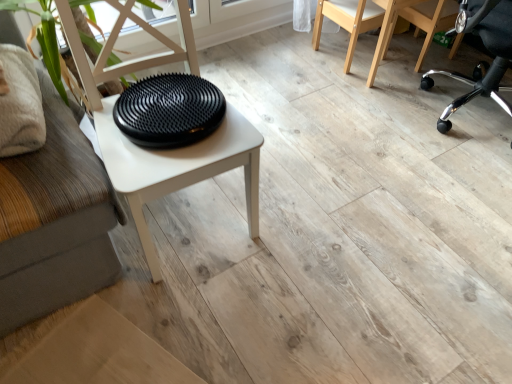
The image size is (512, 384). What do you see at coordinates (169, 110) in the screenshot?
I see `black rubberized disc at center` at bounding box center [169, 110].

You are a GUI agent. You are given a task and a screenshot of the screen. Output one action in this format:
    pyautogui.click(x=<x>, y=<y>)
    Task: Click on the black plastic chair at upper right, the 2th chair from the left
    The image size is (512, 384).
    Given the screenshot: What is the action you would take?
    pyautogui.click(x=412, y=23)

Image resolution: width=512 pixels, height=384 pixels. Identify the location of black plastic office chair at right, the first chair viewed from the right. (481, 61).

Locate an element on the screen. black rubberized disc at center is located at coordinates (169, 110).

Is black rubberized disc at center closer to camera compared to black plastic office chair at right, which is the 3th chair in left-to-right order?

Yes, black rubberized disc at center is closer to the viewer.

Does black rubberized disc at center have a smaller size compared to black plastic office chair at right, which is the 3th chair in left-to-right order?

Yes.

From the image's perspective, is black rubberized disc at center above or below black plastic office chair at right, which is the 3th chair in left-to-right order?

Based on their image positions, black rubberized disc at center is located beneath black plastic office chair at right, which is the 3th chair in left-to-right order.

From a real-world perspective, which object rests below the other?

black plastic office chair at right, the first chair viewed from the right, from a real-world perspective.

Does point (511, 29) lie in front of point (364, 29)?

Yes, it is in front of point (364, 29).

Is natural wood chair at upper right, the third chair from the right, inside black plastic office chair at right, the first chair viewed from the right?

No, black plastic office chair at right, the first chair viewed from the right, does not contain natural wood chair at upper right, the third chair from the right.

Where is `chair that is the 1st object located behind the black plastic office chair at right, the first chair viewed from the right`? chair that is the 1st object located behind the black plastic office chair at right, the first chair viewed from the right is located at coordinates (348, 21).

In the scene shown: Is black plastic office chair at right, which is the 3th chair in left-to-right order, shorter than natural wood chair at upper right, the third chair from the right?

Incorrect, the height of black plastic office chair at right, which is the 3th chair in left-to-right order, does not fall short of that of natural wood chair at upper right, the third chair from the right.

Would you say black plastic chair at upper right, which is the 2th chair from right to left, is to the left or to the right of natural wood chair at upper right, the third chair from the right, in the picture?

black plastic chair at upper right, which is the 2th chair from right to left, is to the right of natural wood chair at upper right, the third chair from the right.

Considering the points (435, 1) and (364, 4), which point is behind, point (435, 1) or point (364, 4)?

The point (435, 1) is farther.

Does black plastic chair at upper right, which is the 2th chair from right to left, turn towards natural wood chair at upper right, arranged as the first chair when viewed from the left?

No, black plastic chair at upper right, which is the 2th chair from right to left, is not oriented towards natural wood chair at upper right, arranged as the first chair when viewed from the left.

Can you confirm if natural wood chair at upper right, the third chair from the right, is smaller than black plastic chair at upper right, the 2th chair from the left?

Yes, natural wood chair at upper right, the third chair from the right, is smaller than black plastic chair at upper right, the 2th chair from the left.

Is natural wood chair at upper right, the third chair from the right, not within black plastic chair at upper right, the 2th chair from the left?

natural wood chair at upper right, the third chair from the right, lies outside black plastic chair at upper right, the 2th chair from the left,'s area.

From a real-world perspective, which chair is the 1st one above the black plastic chair at upper right, the 2th chair from the left? Please provide its 2D coordinates.

[(348, 21)]

Does point (364, 6) come behind point (490, 8)?

Yes, it is.

Between natural wood chair at upper right, the third chair from the right, and black plastic office chair at right, which is the 3th chair in left-to-right order, which one appears on the right side from the viewer's perspective?

Positioned to the right is black plastic office chair at right, which is the 3th chair in left-to-right order.

Does natural wood chair at upper right, arranged as the first chair when viewed from the left, have a larger size compared to black plastic office chair at right, the first chair viewed from the right?

Actually, natural wood chair at upper right, arranged as the first chair when viewed from the left, might be smaller than black plastic office chair at right, the first chair viewed from the right.

From a real-world perspective, who is located lower, natural wood chair at upper right, the third chair from the right, or black plastic office chair at right, the first chair viewed from the right?

natural wood chair at upper right, the third chair from the right, from a real-world perspective.

Is point (416, 16) behind point (172, 112)?

Yes, point (416, 16) is behind point (172, 112).

Choose the correct answer: Is black plastic chair at upper right, which is the 2th chair from right to left, inside black rubberized disc at center or outside it?

black plastic chair at upper right, which is the 2th chair from right to left, is located beyond the bounds of black rubberized disc at center.

Considering the sizes of black plastic chair at upper right, the 2th chair from the left, and black rubberized disc at center in the image, is black plastic chair at upper right, the 2th chair from the left, bigger or smaller than black rubberized disc at center?

Considering their sizes, black plastic chair at upper right, the 2th chair from the left, takes up more space than black rubberized disc at center.

Could you tell me if black plastic chair at upper right, which is the 2th chair from right to left, is turned towards black rubberized disc at center?

No, black plastic chair at upper right, which is the 2th chair from right to left, is not facing towards black rubberized disc at center.

Is natural wood chair at upper right, arranged as the first chair when viewed from the left, wider than black rubberized disc at center?

No.

In the scene shown: Between natural wood chair at upper right, the third chair from the right, and black rubberized disc at center, which one has more height?

With more height is natural wood chair at upper right, the third chair from the right.

Measure the distance from natural wood chair at upper right, arranged as the first chair when viewed from the left, to black rubberized disc at center.

natural wood chair at upper right, arranged as the first chair when viewed from the left, is 1.17 meters away from black rubberized disc at center.

From the image's perspective, between natural wood chair at upper right, arranged as the first chair when viewed from the left, and black rubberized disc at center, who is located below?

black rubberized disc at center appears lower in the image.

I want to click on tray above the black plastic office chair at right, which is the 3th chair in left-to-right order (from a real-world perspective), so [169, 110].

Locate an element on the screen. The width and height of the screenshot is (512, 384). the 2nd chair to the left of the black plastic office chair at right, the first chair viewed from the right, counting from the anchor's position is located at coordinates (348, 21).

When comparing their distances from natural wood chair at upper right, the third chair from the right, does black plastic chair at upper right, which is the 2th chair from right to left, or black plastic office chair at right, the first chair viewed from the right, seem further?

black plastic office chair at right, the first chair viewed from the right, lies further to natural wood chair at upper right, the third chair from the right, than the other object.

Based on their spatial positions, is natural wood chair at upper right, the third chair from the right, or black plastic office chair at right, which is the 3th chair in left-to-right order, closer to black rubberized disc at center?

natural wood chair at upper right, the third chair from the right, is closer to black rubberized disc at center.

Considering their positions, is black plastic office chair at right, the first chair viewed from the right, positioned closer to black rubberized disc at center than natural wood chair at upper right, the third chair from the right?

natural wood chair at upper right, the third chair from the right, lies closer to black rubberized disc at center than the other object.

Which object lies further to the anchor point black plastic chair at upper right, which is the 2th chair from right to left, black plastic office chair at right, which is the 3th chair in left-to-right order, or natural wood chair at upper right, the third chair from the right?

black plastic office chair at right, which is the 3th chair in left-to-right order, is positioned further to the anchor black plastic chair at upper right, which is the 2th chair from right to left.

From the picture: Considering their positions, is black plastic office chair at right, which is the 3th chair in left-to-right order, positioned further to black rubberized disc at center than black plastic chair at upper right, which is the 2th chair from right to left?

black plastic office chair at right, which is the 3th chair in left-to-right order, is positioned further to the anchor black rubberized disc at center.

Considering their positions, is black rubberized disc at center positioned further to black plastic chair at upper right, which is the 2th chair from right to left, than black plastic office chair at right, which is the 3th chair in left-to-right order?

The object further to black plastic chair at upper right, which is the 2th chair from right to left, is black rubberized disc at center.

Considering their positions, is black rubberized disc at center positioned closer to black plastic office chair at right, the first chair viewed from the right, than natural wood chair at upper right, the third chair from the right?

natural wood chair at upper right, the third chair from the right, lies closer to black plastic office chair at right, the first chair viewed from the right, than the other object.

Considering their positions, is black rubberized disc at center positioned further to black plastic chair at upper right, which is the 2th chair from right to left, than natural wood chair at upper right, arranged as the first chair when viewed from the left?

black rubberized disc at center.

Where is `chair between black plastic office chair at right, the first chair viewed from the right, and black plastic chair at upper right, the 2th chair from the left, from front to back`? chair between black plastic office chair at right, the first chair viewed from the right, and black plastic chair at upper right, the 2th chair from the left, from front to back is located at coordinates (348, 21).

Locate an element on the screen. The height and width of the screenshot is (384, 512). chair between black rubberized disc at center and black plastic chair at upper right, which is the 2th chair from right to left, from left to right is located at coordinates (348, 21).